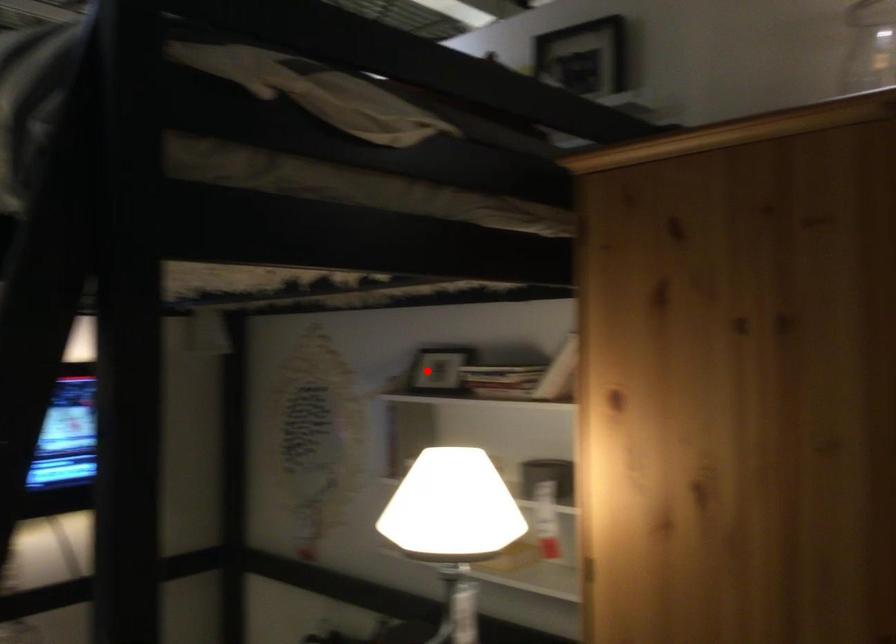
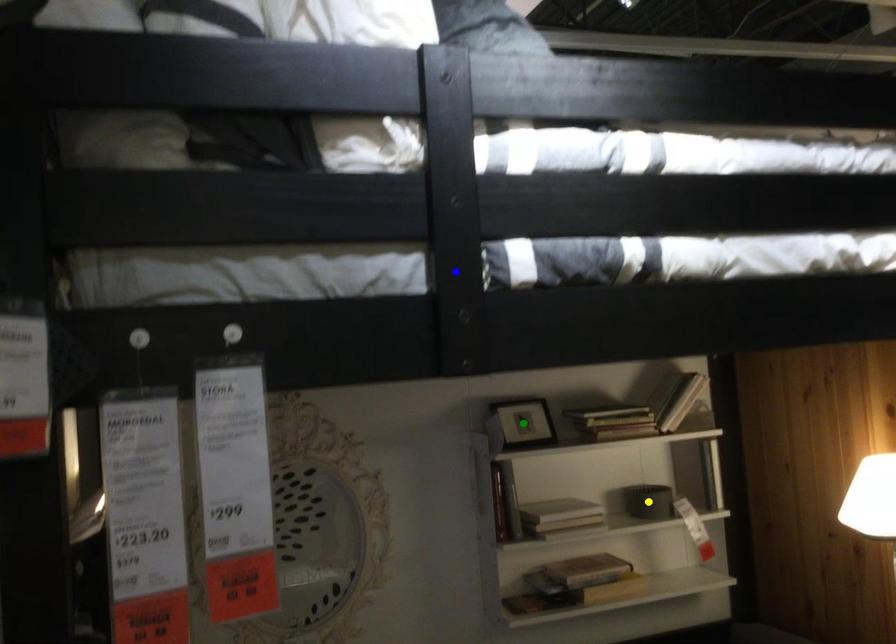
Question: I am providing you with two images of the same scene from different viewpoints. A red point is marked on the first image. You are given multiple points on the second image. Which point in image 2 is actually the same real-world point as the red point in image 1?

Choices:
 (A) green point
 (B) yellow point
 (C) blue point

Answer: (A)